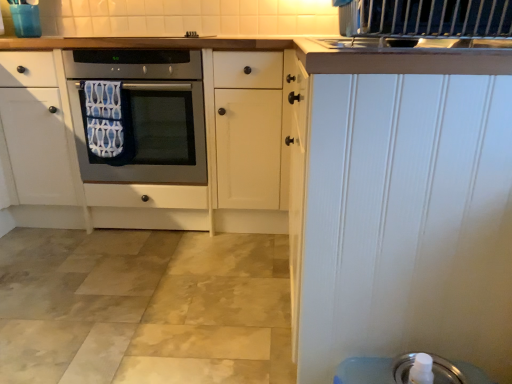
Describe the element at coordinates (104, 119) in the screenshot. I see `blue patterned towel at center` at that location.

Image resolution: width=512 pixels, height=384 pixels. I want to click on white painted wood door at upper right, so click(407, 221).

Visually, is blue patterned towel at center positioned to the left or to the right of silver metallic soap dispenser at lower right?

From the image, it's evident that blue patterned towel at center is to the left of silver metallic soap dispenser at lower right.

What's the angular difference between blue patterned towel at center and silver metallic soap dispenser at lower right's facing directions?

88.5 degrees.

Is blue patterned towel at center located outside silver metallic soap dispenser at lower right?

Yes, blue patterned towel at center is outside of silver metallic soap dispenser at lower right.

From the image's perspective, which is above, blue patterned towel at center or silver metallic soap dispenser at lower right?

blue patterned towel at center, from the image's perspective.

Between white painted wood door at upper right and blue patterned towel at center, which one has larger width?

Wider between the two is white painted wood door at upper right.

Where is `bath towel behind the white painted wood door at upper right`? The height and width of the screenshot is (384, 512). bath towel behind the white painted wood door at upper right is located at coordinates (104, 119).

Can you tell me how much white painted wood door at upper right and blue patterned towel at center differ in facing direction?

There is a 86.2-degree angle between the facing directions of white painted wood door at upper right and blue patterned towel at center.

Which of these two, silver metallic soap dispenser at lower right or white painted wood door at upper right, is wider?

white painted wood door at upper right.

From the image's perspective, between silver metallic soap dispenser at lower right and white painted wood door at upper right, which one is located above?

From the image's view, white painted wood door at upper right is above.

Is silver metallic soap dispenser at lower right oriented away from white painted wood door at upper right?

That's not correct — silver metallic soap dispenser at lower right is not looking away from white painted wood door at upper right.

In order to click on door above the silver metallic soap dispenser at lower right (from a real-world perspective) in this screenshot , I will do `click(407, 221)`.

What are the coordinates of `oven directly beneath the blue patterned towel at center (from a real-world perspective)` in the screenshot? It's located at (143, 115).

Can you confirm if blue patterned towel at center is taller than satin silver oven at center?

No.

Is point (89, 90) closer to camera compared to point (197, 84)?

No, (89, 90) is behind (197, 84).

Considering the positions of objects blue patterned towel at center and white painted wood door at upper right in the image provided, who is in front, blue patterned towel at center or white painted wood door at upper right?

white painted wood door at upper right is in front.

Which is in front, point (115, 109) or point (350, 139)?

The point (350, 139) is closer.

Which object is positioned more to the right, blue patterned towel at center or white painted wood door at upper right?

Positioned to the right is white painted wood door at upper right.

From the image's perspective, is white painted wood door at upper right on top of silver metallic soap dispenser at lower right?

Yes, from the image's perspective, white painted wood door at upper right is over silver metallic soap dispenser at lower right.

Could you tell me if white painted wood door at upper right is facing silver metallic soap dispenser at lower right?

No, white painted wood door at upper right is not turned towards silver metallic soap dispenser at lower right.

Where is `appliance below the white painted wood door at upper right (from the image's perspective)`? appliance below the white painted wood door at upper right (from the image's perspective) is located at coordinates (430, 370).

Is point (440, 115) farther from viewer compared to point (402, 365)?

That is False.

From the image's perspective, is white painted wood door at upper right on satin silver oven at center?

Incorrect, from the image's perspective, white painted wood door at upper right is lower than satin silver oven at center.

Measure the distance from white painted wood door at upper right to satin silver oven at center.

white painted wood door at upper right is 4.02 feet from satin silver oven at center.

Would you say white painted wood door at upper right is a long distance from satin silver oven at center?

That's right, there is a large distance between white painted wood door at upper right and satin silver oven at center.

Would you say white painted wood door at upper right is inside or outside satin silver oven at center?

The correct answer is: outside.

Where is `bath towel to the left of silver metallic soap dispenser at lower right`? bath towel to the left of silver metallic soap dispenser at lower right is located at coordinates (104, 119).

You are a GUI agent. You are given a task and a screenshot of the screen. Output one action in this format:
    pyautogui.click(x=<x>, y=<y>)
    Task: Click on the bath towel above the white painted wood door at upper right (from a real-world perspective)
    The height and width of the screenshot is (384, 512).
    Given the screenshot: What is the action you would take?
    pyautogui.click(x=104, y=119)

From the image, which object appears to be farther from white painted wood door at upper right, blue patterned towel at center or satin silver oven at center?

Among the two, blue patterned towel at center is located further to white painted wood door at upper right.

Which object lies nearer to the anchor point blue patterned towel at center, satin silver oven at center or white painted wood door at upper right?

The object closer to blue patterned towel at center is satin silver oven at center.

Looking at the image, which one is located further to satin silver oven at center, blue patterned towel at center or silver metallic soap dispenser at lower right?

Among the two, silver metallic soap dispenser at lower right is located further to satin silver oven at center.

Which object lies nearer to the anchor point silver metallic soap dispenser at lower right, blue patterned towel at center or satin silver oven at center?

Among the two, satin silver oven at center is located nearer to silver metallic soap dispenser at lower right.

Estimate the real-world distances between objects in this image. Which object is closer to silver metallic soap dispenser at lower right, satin silver oven at center or blue patterned towel at center?

satin silver oven at center.

Which object lies further to the anchor point white painted wood door at upper right, silver metallic soap dispenser at lower right or blue patterned towel at center?

blue patterned towel at center is further to white painted wood door at upper right.

Which object lies further to the anchor point silver metallic soap dispenser at lower right, blue patterned towel at center or white painted wood door at upper right?

blue patterned towel at center is positioned further to the anchor silver metallic soap dispenser at lower right.

Considering their positions, is satin silver oven at center positioned further to silver metallic soap dispenser at lower right than white painted wood door at upper right?

Among the two, satin silver oven at center is located further to silver metallic soap dispenser at lower right.

In order to click on appliance between blue patterned towel at center and white painted wood door at upper right from left to right in this screenshot , I will do `click(430, 370)`.

In order to click on appliance between white painted wood door at upper right and satin silver oven at center from front to back in this screenshot , I will do (430, 370).

This screenshot has height=384, width=512. In order to click on oven located between blue patterned towel at center and white painted wood door at upper right in the left-right direction in this screenshot , I will do `click(143, 115)`.

What are the coordinates of `oven between blue patterned towel at center and silver metallic soap dispenser at lower right` in the screenshot? It's located at (143, 115).